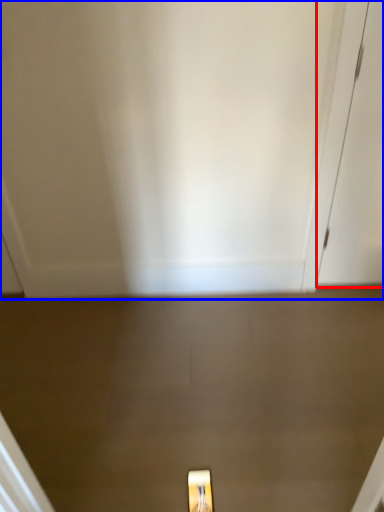
Question: Which point is closer to the camera, door (highlighted by a red box) or door (highlighted by a blue box)?

Choices:
 (A) door
 (B) door

Answer: (B)